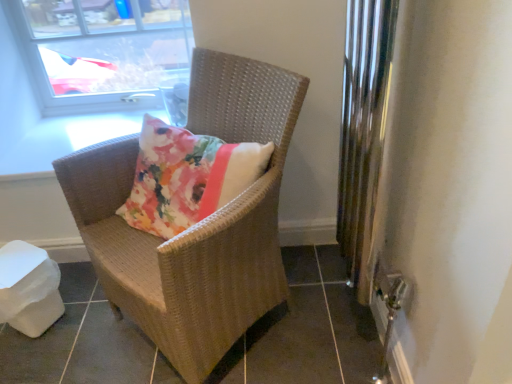
Question: From their relative heights in the image, would you say woven brown chair at center is taller or shorter than transparent glass window at upper left?

Choices:
 (A) tall
 (B) short

Answer: (A)

Question: From a real-world perspective, is woven brown chair at center physically located above or below transparent glass window at upper left?

Choices:
 (A) below
 (B) above

Answer: (A)

Question: Is point (96, 183) positioned closer to the camera than point (141, 41)?

Choices:
 (A) closer
 (B) farther

Answer: (A)

Question: Does point (91, 33) appear closer or farther from the camera than point (224, 352)?

Choices:
 (A) closer
 (B) farther

Answer: (B)

Question: Would you say transparent glass window at upper left is inside or outside woven brown chair at center?

Choices:
 (A) outside
 (B) inside

Answer: (A)

Question: In the image, is transparent glass window at upper left positioned in front of or behind woven brown chair at center?

Choices:
 (A) behind
 (B) front

Answer: (A)

Question: Based on their sizes in the image, would you say transparent glass window at upper left is bigger or smaller than woven brown chair at center?

Choices:
 (A) small
 (B) big

Answer: (A)